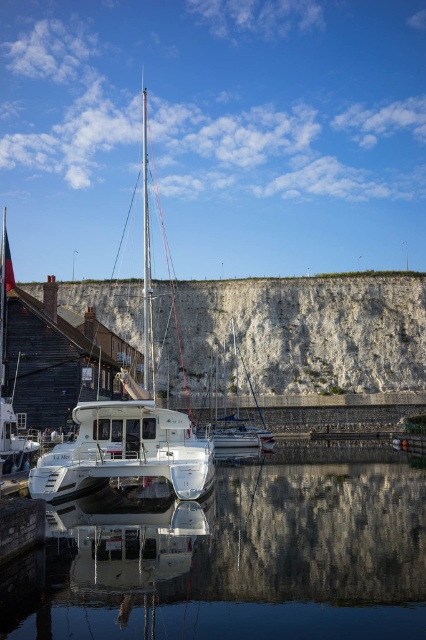
You are a sailor planning to anchor your boat near the transparent glass water at center. Considering the white stone cliff at center, what should you be cautious about?

You should be cautious of the white stone cliff at center because the transparent glass water at center is positioned under it, which might indicate shallow waters or underwater hazards near the cliff base.

You are a photographer planning to capture the white stone cliff at center and the white glossy catamaran at center in a single shot. Based on their sizes in the scene, which object would appear wider in the photograph?

The white stone cliff at center would appear wider in the photograph since its width is larger than that of the white glossy catamaran at center.

You are a photographer planning to take a photo of the white stone cliff at center and the white glossy catamaran at center. Which object should you focus on first if you want to capture both in a single frame without changing your camera settings? Explain your reasoning based on their sizes in the image.

You should focus on the white stone cliff at center first because it is much taller than the white glossy catamaran at center, making it the dominant subject in the frame.